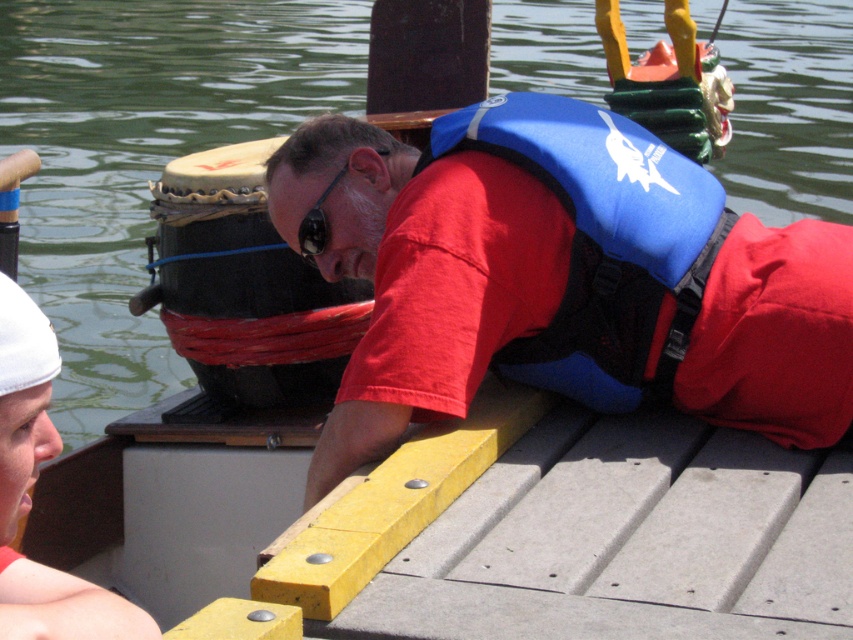
Question: Estimate the real-world distances between objects in this image. Which object is farther from the blue neoprene life vest at center?

Choices:
 (A) black rubber goggles at center
 (B) blue fabric life vest at center

Answer: (A)

Question: Estimate the real-world distances between objects in this image. Which object is farther from the blue neoprene life vest at center?

Choices:
 (A) blue fabric life vest at center
 (B) black rubber goggles at center

Answer: (B)

Question: From the image, what is the correct spatial relationship of blue neoprene life vest at center in relation to black rubber goggles at center?

Choices:
 (A) below
 (B) above

Answer: (A)

Question: Can you confirm if blue fabric life vest at center is positioned below blue neoprene life vest at center?

Choices:
 (A) no
 (B) yes

Answer: (B)

Question: Among these objects, which one is nearest to the camera?

Choices:
 (A) blue neoprene life vest at center
 (B) blue fabric life vest at center
 (C) black rubber goggles at center

Answer: (B)

Question: Does blue fabric life vest at center appear on the right side of black rubber goggles at center?

Choices:
 (A) no
 (B) yes

Answer: (B)